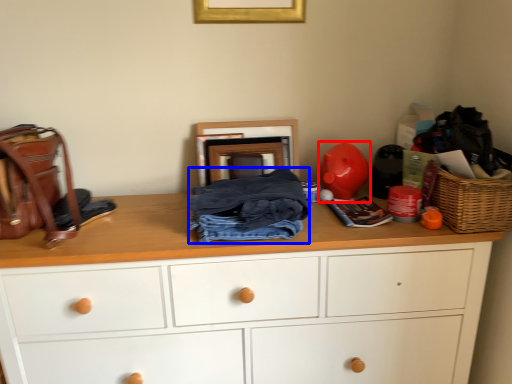
Question: Among these objects, which one is nearest to the camera, toy (highlighted by a red box) or clothing (highlighted by a blue box)?

Choices:
 (A) toy
 (B) clothing

Answer: (B)